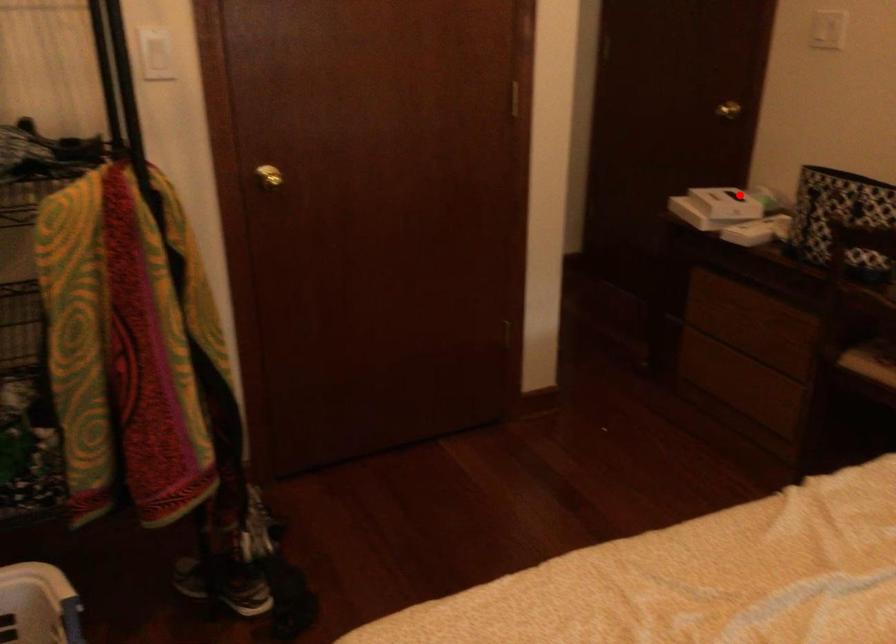
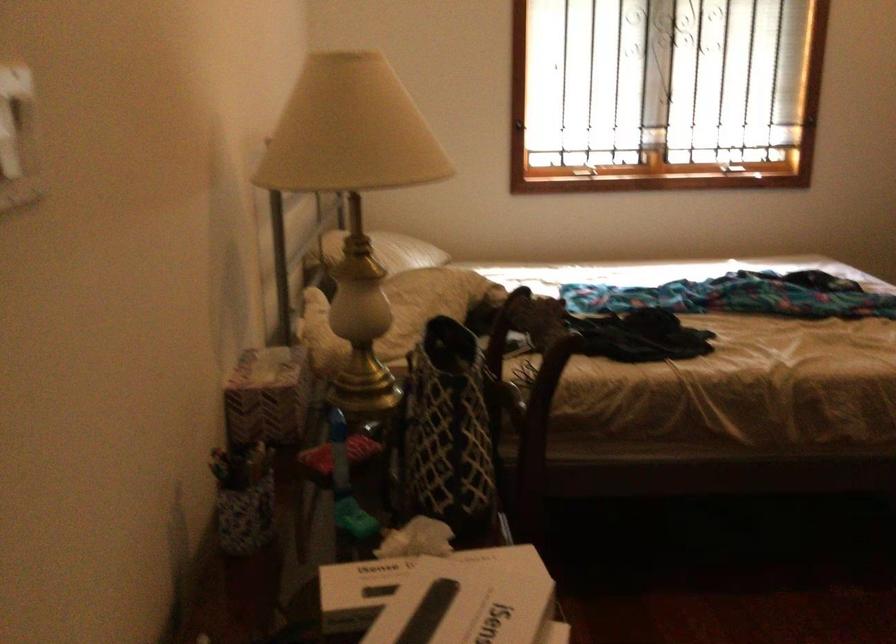
The point at the highlighted location is marked in the first image. Where is the corresponding point in the second image?

(407, 583)